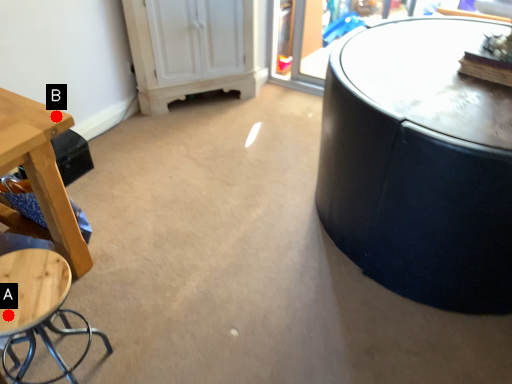
Question: Two points are circled on the image, labeled by A and B beside each circle. Among these points, which one is farthest from the camera?

Choices:
 (A) A is further
 (B) B is further

Answer: (B)